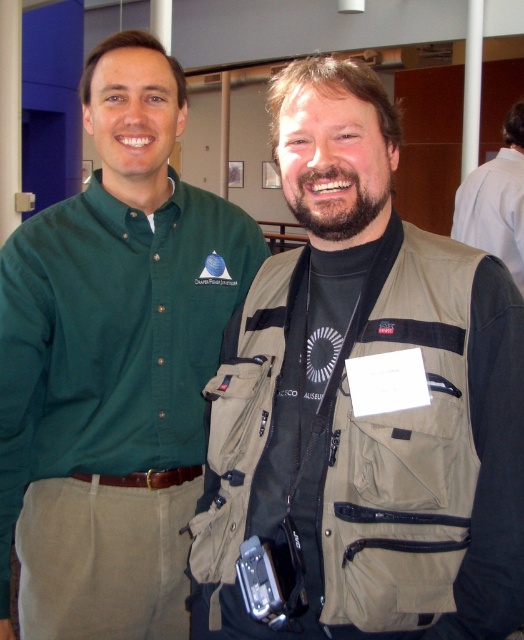
Which is more to the left, khaki fabric vest at center or green button-down shirt at left?

Positioned to the left is green button-down shirt at left.

Does khaki fabric vest at center come in front of green button-down shirt at left?

Yes, it is in front of green button-down shirt at left.

Is point (518, 444) positioned before point (47, 352)?

Yes, point (518, 444) is closer to viewer.

Locate an element on the screen. The height and width of the screenshot is (640, 524). khaki fabric vest at center is located at coordinates (361, 403).

Is green button-down shirt at left below white shirt at upper right?

Indeed, green button-down shirt at left is positioned under white shirt at upper right.

Which is above, green button-down shirt at left or white shirt at upper right?

white shirt at upper right

Is point (201, 298) positioned in front of point (498, 240)?

Yes, point (201, 298) is in front of point (498, 240).

The image size is (524, 640). Find the location of `green button-down shirt at left`. green button-down shirt at left is located at coordinates (114, 364).

Is khaki fabric vest at center in front of white shirt at upper right?

That is True.

Can you confirm if khaki fabric vest at center is taller than white shirt at upper right?

Correct, khaki fabric vest at center is much taller as white shirt at upper right.

Where is `khaki fabric vest at center`? The height and width of the screenshot is (640, 524). khaki fabric vest at center is located at coordinates click(361, 403).